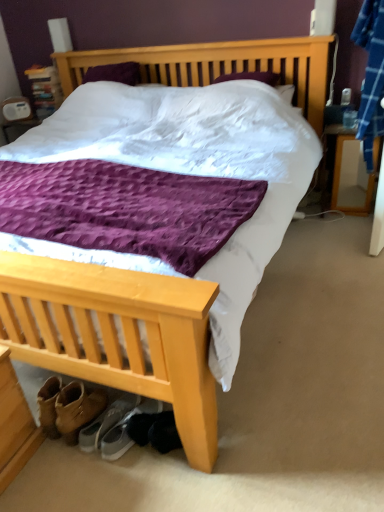
Question: Considering the relative sizes of gray suede sneakers at lower left, positioned as the first footwear in left-to-right order, and wooden nightstand at right in the image provided, is gray suede sneakers at lower left, positioned as the first footwear in left-to-right order, shorter than wooden nightstand at right?

Choices:
 (A) yes
 (B) no

Answer: (A)

Question: Is gray suede sneakers at lower left, the second footwear from the right, facing towards wooden nightstand at right?

Choices:
 (A) yes
 (B) no

Answer: (A)

Question: Is the position of gray suede sneakers at lower left, the second footwear from the right, more distant than that of wooden nightstand at right?

Choices:
 (A) no
 (B) yes

Answer: (A)

Question: From the image's perspective, is gray suede sneakers at lower left, positioned as the first footwear in left-to-right order, on wooden nightstand at right?

Choices:
 (A) no
 (B) yes

Answer: (A)

Question: Considering the relative positions of gray suede sneakers at lower left, positioned as the first footwear in left-to-right order, and wooden nightstand at right in the image provided, is gray suede sneakers at lower left, positioned as the first footwear in left-to-right order, to the right of wooden nightstand at right from the viewer's perspective?

Choices:
 (A) yes
 (B) no

Answer: (B)

Question: Does gray suede sneakers at lower left, positioned as the first footwear in left-to-right order, come in front of wooden nightstand at right?

Choices:
 (A) yes
 (B) no

Answer: (A)

Question: Is gray fabric sneakers at lower center, which is the first footwear in right-to-left order, smaller than gray suede sneakers at lower left, the second footwear from the right?

Choices:
 (A) no
 (B) yes

Answer: (A)

Question: Is gray fabric sneakers at lower center, which is the first footwear in right-to-left order, in front of gray suede sneakers at lower left, positioned as the first footwear in left-to-right order?

Choices:
 (A) no
 (B) yes

Answer: (B)

Question: From a real-world perspective, is gray fabric sneakers at lower center, placed as the 2th footwear when sorted from left to right, on top of gray suede sneakers at lower left, the second footwear from the right?

Choices:
 (A) no
 (B) yes

Answer: (A)

Question: Is gray fabric sneakers at lower center, which is the first footwear in right-to-left order, positioned with its back to gray suede sneakers at lower left, positioned as the first footwear in left-to-right order?

Choices:
 (A) no
 (B) yes

Answer: (A)

Question: Does gray fabric sneakers at lower center, which is the first footwear in right-to-left order, turn towards gray suede sneakers at lower left, positioned as the first footwear in left-to-right order?

Choices:
 (A) yes
 (B) no

Answer: (B)

Question: Does gray fabric sneakers at lower center, which is the first footwear in right-to-left order, appear on the left side of gray suede sneakers at lower left, positioned as the first footwear in left-to-right order?

Choices:
 (A) no
 (B) yes

Answer: (A)

Question: From a real-world perspective, is wooden nightstand at right on gray fabric sneakers at lower center, placed as the 2th footwear when sorted from left to right?

Choices:
 (A) no
 (B) yes

Answer: (B)